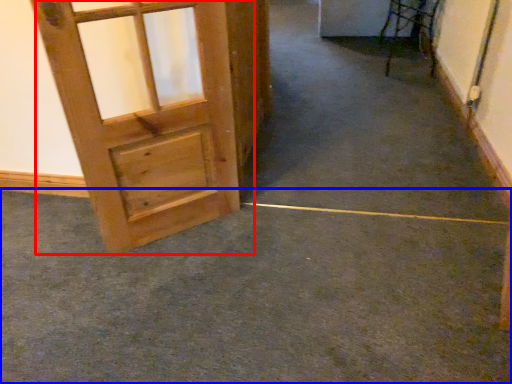
Question: Which of the following is the closest to the observer, door (highlighted by a red box) or concrete (highlighted by a blue box)?

Choices:
 (A) door
 (B) concrete

Answer: (B)